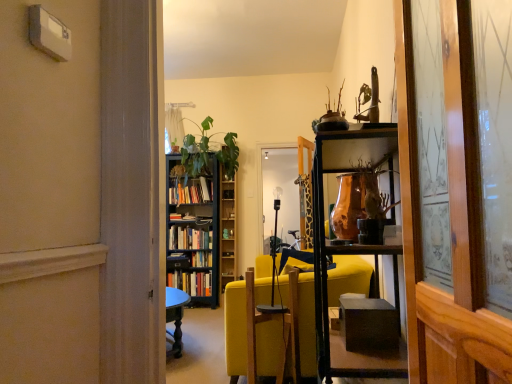
Question: Is green leafy plant at center not near copper metallic vase at center?

Choices:
 (A) yes
 (B) no

Answer: (A)

Question: From a real-world perspective, is green leafy plant at center on copper metallic vase at center?

Choices:
 (A) no
 (B) yes

Answer: (B)

Question: Is green leafy plant at center with copper metallic vase at center?

Choices:
 (A) yes
 (B) no

Answer: (B)

Question: Is green leafy plant at center at the left side of copper metallic vase at center?

Choices:
 (A) no
 (B) yes

Answer: (B)

Question: Considering the relative sizes of green leafy plant at center and copper metallic vase at center in the image provided, is green leafy plant at center bigger than copper metallic vase at center?

Choices:
 (A) yes
 (B) no

Answer: (A)

Question: From a real-world perspective, relative to hardcover books at center, which is the 3th book from bottom to top, is green matte bookshelf at center vertically above or below?

Choices:
 (A) below
 (B) above

Answer: (A)

Question: Is green matte bookshelf at center to the left or to the right of hardcover books at center, which is the 3th book from bottom to top, in the image?

Choices:
 (A) left
 (B) right

Answer: (B)

Question: From the image's perspective, is green matte bookshelf at center above or below hardcover books at center, marked as the first book in a top-to-bottom arrangement?

Choices:
 (A) below
 (B) above

Answer: (A)

Question: Does point (232, 220) appear closer or farther from the camera than point (186, 187)?

Choices:
 (A) farther
 (B) closer

Answer: (A)

Question: Relative to green matte bookshelf at center, is black wooden bookcase at center in front or behind?

Choices:
 (A) behind
 (B) front

Answer: (B)

Question: Visually, is black wooden bookcase at center positioned to the left or to the right of green matte bookshelf at center?

Choices:
 (A) left
 (B) right

Answer: (A)

Question: From the image's perspective, is black wooden bookcase at center positioned above or below green matte bookshelf at center?

Choices:
 (A) above
 (B) below

Answer: (B)

Question: Considering the positions of black wooden bookcase at center and green matte bookshelf at center in the image, is black wooden bookcase at center bigger or smaller than green matte bookshelf at center?

Choices:
 (A) big
 (B) small

Answer: (A)

Question: Based on their sizes in the image, would you say wooden swivel chair at center is bigger or smaller than black wooden bookcase at center?

Choices:
 (A) small
 (B) big

Answer: (A)

Question: Do you think wooden swivel chair at center is within black wooden bookcase at center, or outside of it?

Choices:
 (A) outside
 (B) inside

Answer: (A)